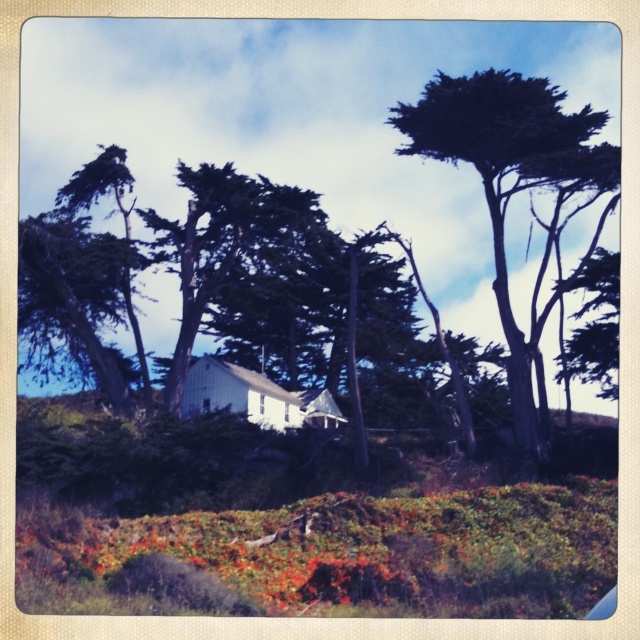
Question: Which point is closer to the camera taking this photo?

Choices:
 (A) (524, 522)
 (B) (486, 88)

Answer: (A)

Question: From the image, what is the correct spatial relationship of green leafy bush at lower center in relation to dark green textured tree at upper right?

Choices:
 (A) right
 (B) left

Answer: (B)

Question: Which of the following is the closest to the observer?

Choices:
 (A) green leafy bush at lower center
 (B) dark green textured tree at upper right

Answer: (A)

Question: Is green leafy bush at lower center positioned in front of dark green textured tree at upper right?

Choices:
 (A) no
 (B) yes

Answer: (B)

Question: Which point is closer to the camera taking this photo?

Choices:
 (A) (115, 586)
 (B) (508, 74)

Answer: (A)

Question: Is green leafy bush at lower center positioned before dark green textured tree at upper right?

Choices:
 (A) yes
 (B) no

Answer: (A)